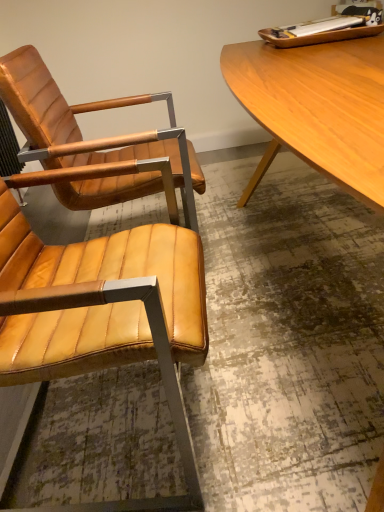
Question: Is matte leather chair at left, the 1th chair positioned from the back, at the right side of matte leather chair at left, positioned as the first chair in front-to-back order?

Choices:
 (A) yes
 (B) no

Answer: (A)

Question: Can you confirm if matte leather chair at left, the 2th chair in the front-to-back sequence, is wider than matte leather chair at left, positioned as the first chair in front-to-back order?

Choices:
 (A) no
 (B) yes

Answer: (B)

Question: Is matte leather chair at left, the 1th chair positioned from the back, turned away from matte leather chair at left, positioned as the first chair in front-to-back order?

Choices:
 (A) no
 (B) yes

Answer: (A)

Question: Can you confirm if matte leather chair at left, the 1th chair positioned from the back, is thinner than matte leather chair at left, positioned as the first chair in front-to-back order?

Choices:
 (A) yes
 (B) no

Answer: (B)

Question: Can we say matte leather chair at left, the 2th chair in the front-to-back sequence, lies outside matte leather chair at left, positioned as the first chair in front-to-back order?

Choices:
 (A) no
 (B) yes

Answer: (B)

Question: From a real-world perspective, is matte leather chair at left, the 1th chair positioned from the back, physically located above or below matte leather chair at left, positioned as the first chair in front-to-back order?

Choices:
 (A) above
 (B) below

Answer: (A)

Question: Is matte leather chair at left, the 1th chair positioned from the back, taller or shorter than matte leather chair at left, placed as the second chair when sorted from back to front?

Choices:
 (A) short
 (B) tall

Answer: (B)

Question: Is matte leather chair at left, the 1th chair positioned from the back, bigger or smaller than matte leather chair at left, positioned as the first chair in front-to-back order?

Choices:
 (A) small
 (B) big

Answer: (B)

Question: Is point (158, 185) positioned closer to the camera than point (180, 285)?

Choices:
 (A) farther
 (B) closer

Answer: (A)

Question: Visually, is light brown wood desk at upper right positioned to the left or to the right of matte leather chair at left, positioned as the first chair in front-to-back order?

Choices:
 (A) left
 (B) right

Answer: (B)

Question: Is light brown wood desk at upper right in front of or behind matte leather chair at left, placed as the second chair when sorted from back to front, in the image?

Choices:
 (A) front
 (B) behind

Answer: (A)

Question: From a real-world perspective, relative to matte leather chair at left, placed as the second chair when sorted from back to front, is light brown wood desk at upper right vertically above or below?

Choices:
 (A) above
 (B) below

Answer: (B)

Question: Is light brown wood desk at upper right inside or outside of matte leather chair at left, positioned as the first chair in front-to-back order?

Choices:
 (A) outside
 (B) inside

Answer: (A)

Question: From the image's perspective, is matte leather chair at left, positioned as the first chair in front-to-back order, located above or below light brown wood desk at upper right?

Choices:
 (A) below
 (B) above

Answer: (A)

Question: Is matte leather chair at left, positioned as the first chair in front-to-back order, bigger or smaller than light brown wood desk at upper right?

Choices:
 (A) small
 (B) big

Answer: (A)